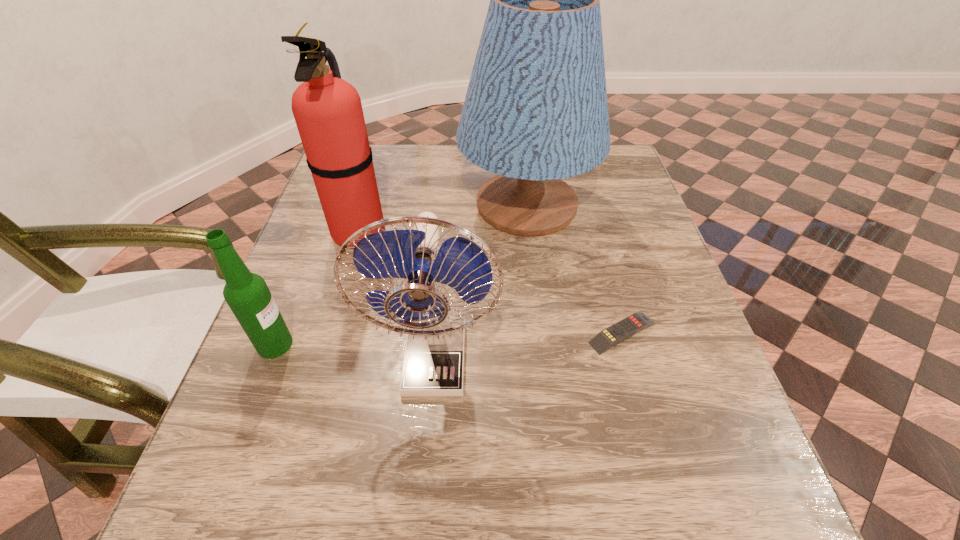
In the image, there is a desktop. What are the coordinates of `vacant space at the far right corner` in the screenshot? It's located at (615, 161).

The width and height of the screenshot is (960, 540). Find the location of `vacant space in between the lampshade and the fire extinguisher`. vacant space in between the lampshade and the fire extinguisher is located at coordinates (443, 219).

Find the location of `vacant space that is in between the third shortest object and the shortest object`. vacant space that is in between the third shortest object and the shortest object is located at coordinates (529, 347).

This screenshot has height=540, width=960. I want to click on vacant space that's between the second shortest object and the third shortest object, so click(x=355, y=353).

The height and width of the screenshot is (540, 960). Find the location of `free space between the remote control and the fan`. free space between the remote control and the fan is located at coordinates (529, 347).

This screenshot has width=960, height=540. I want to click on unoccupied position between the remote control and the fan, so click(x=529, y=347).

Locate an element on the screen. vacant space that's between the fan and the fourth tallest object is located at coordinates (355, 353).

Find the location of a particular element. The height and width of the screenshot is (540, 960). empty space between the beer bottle and the fire extinguisher is located at coordinates (317, 288).

The image size is (960, 540). Identify the location of object that is the closest to the fire extinguisher. (535, 112).

I want to click on object that can be found as the second closest to the shortest object, so click(x=535, y=112).